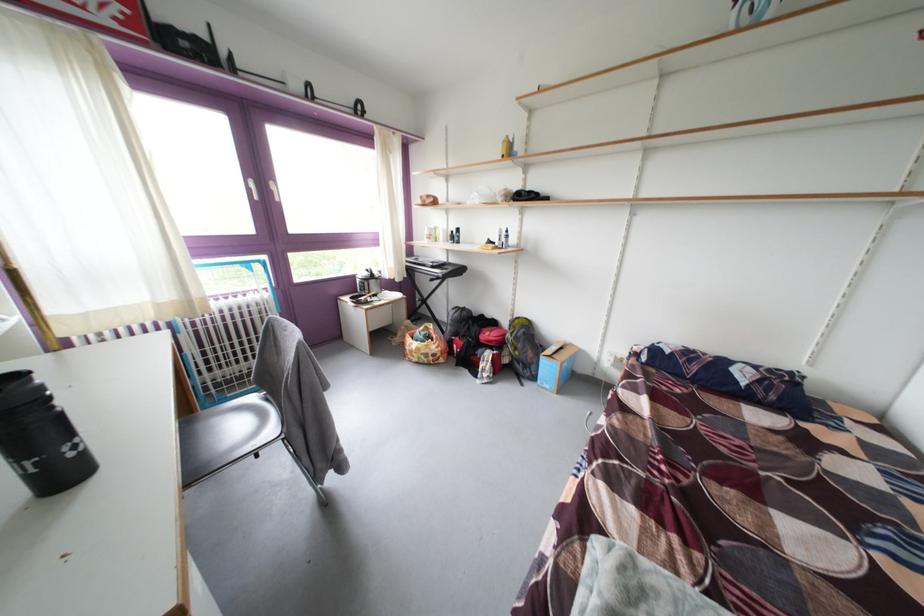
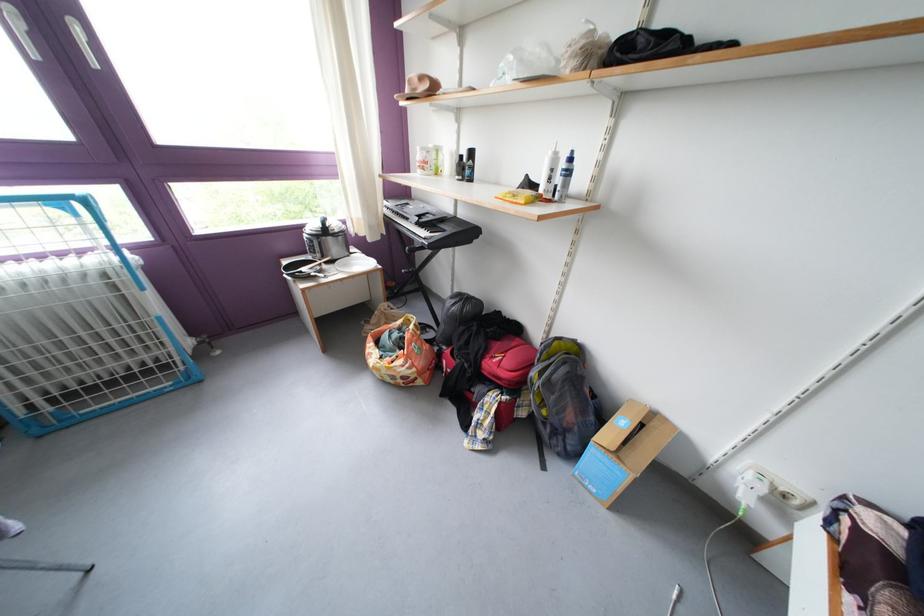
The point at (377, 308) is marked in the first image. Where is the corresponding point in the second image?

(319, 283)